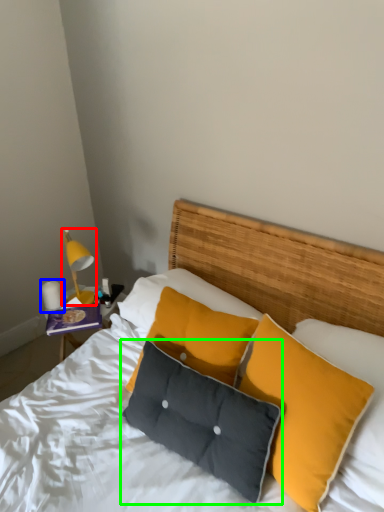
Question: Which is farther away from bedside lamp (highlighted by a red box)? lamp (highlighted by a blue box) or pillow (highlighted by a green box)?

Choices:
 (A) lamp
 (B) pillow

Answer: (B)